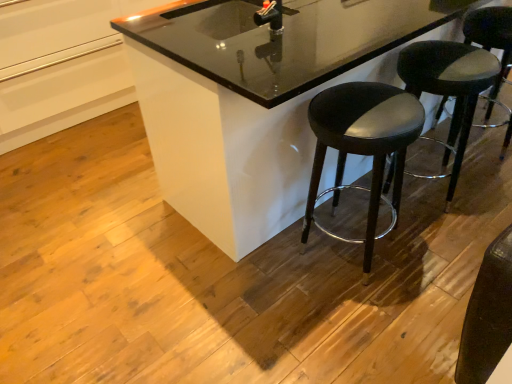
You are a GUI agent. You are given a task and a screenshot of the screen. Output one action in this format:
    pyautogui.click(x=<x>, y=<y>)
    Task: Click on the free space on the front side of black leather stool at center, which is the 3th stool in right-to-left order
    The height and width of the screenshot is (384, 512).
    Given the screenshot: What is the action you would take?
    click(364, 319)